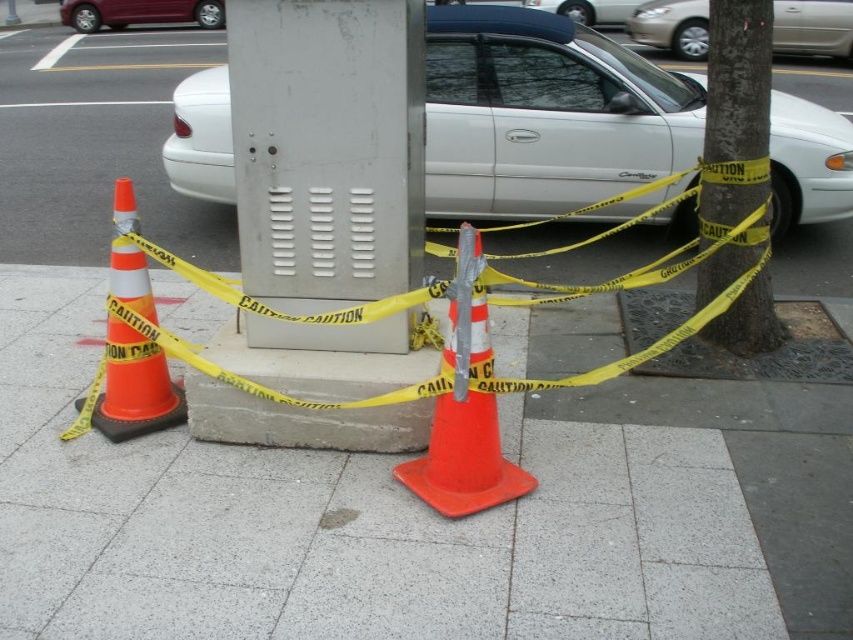
You are standing on the sidewalk and see two points marked on the utility box. Which point, point (125,294) or point (602,22), is closer to you?

Point (125,294) is closer to the viewer than point (602,22).

Based on the photo, you are a delivery person trying to park your 1.8 meters wide van. You see the orange reflective cone at left and the white glossy sedan at upper center in the scene. Can you park your van between these two objects without hitting them?

The orange reflective cone at left is narrower than the white glossy sedan at upper center. Since the van is 1.8 meters wide, there might be enough space between them. However, the exact distance isn